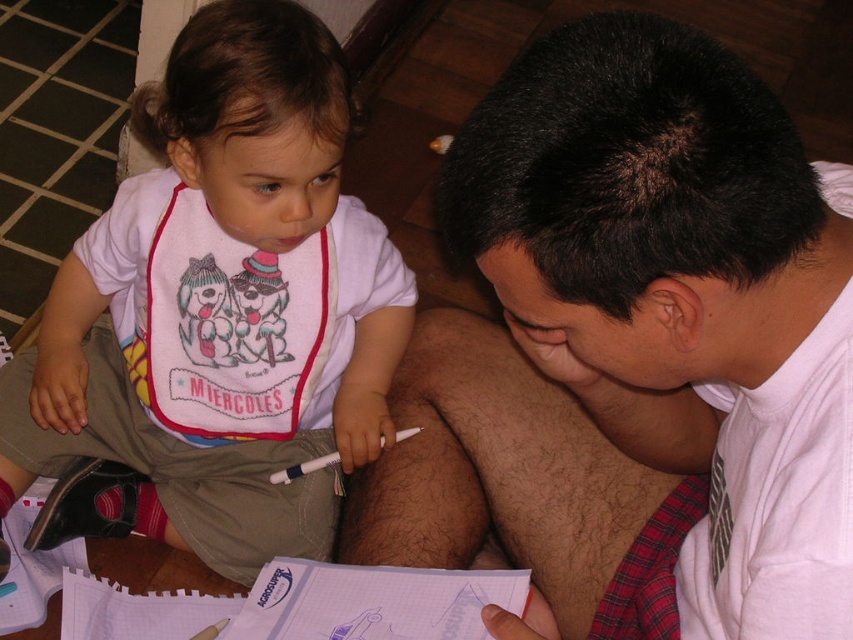
Locate an element on the screen. The height and width of the screenshot is (640, 853). white shirt at upper right is located at coordinates (634, 353).

Is point (537, 449) less distant than point (384, 397)?

Yes, it is in front of point (384, 397).

Find the location of a particular element. The height and width of the screenshot is (640, 853). white shirt at upper right is located at coordinates (634, 353).

The height and width of the screenshot is (640, 853). I want to click on white shirt at upper right, so click(x=634, y=353).